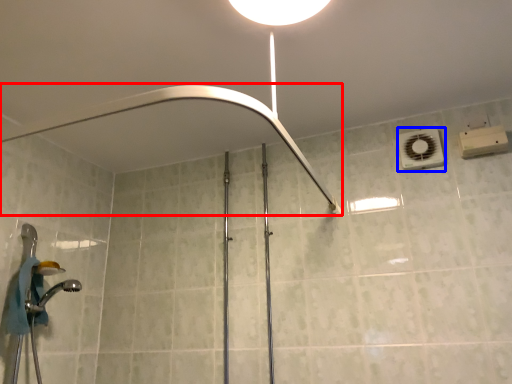
Question: Which object is further to the camera taking this photo, shower (highlighted by a red box) or air conditioner (highlighted by a blue box)?

Choices:
 (A) shower
 (B) air conditioner

Answer: (B)